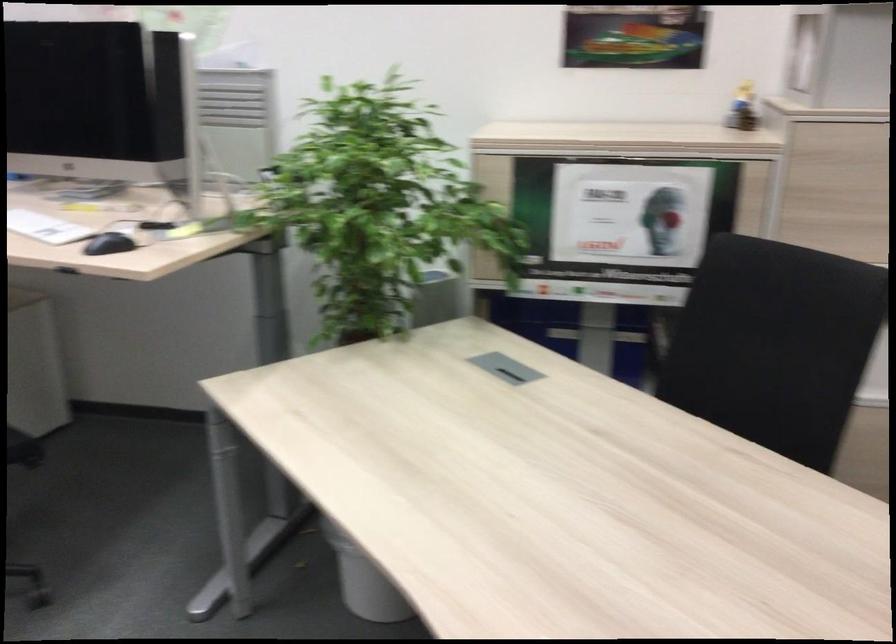
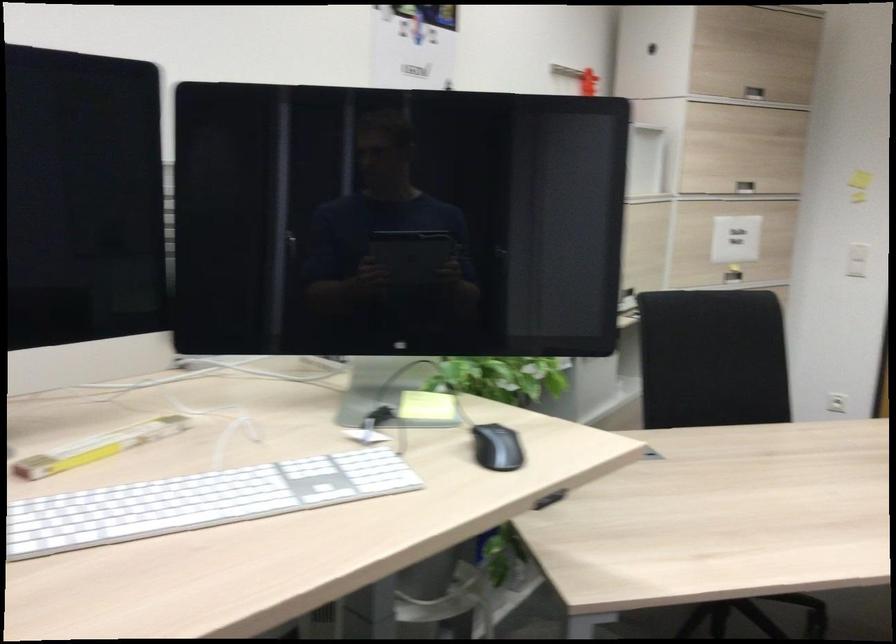
The point at (107, 207) is marked in the first image. Where is the corresponding point in the second image?

(98, 447)